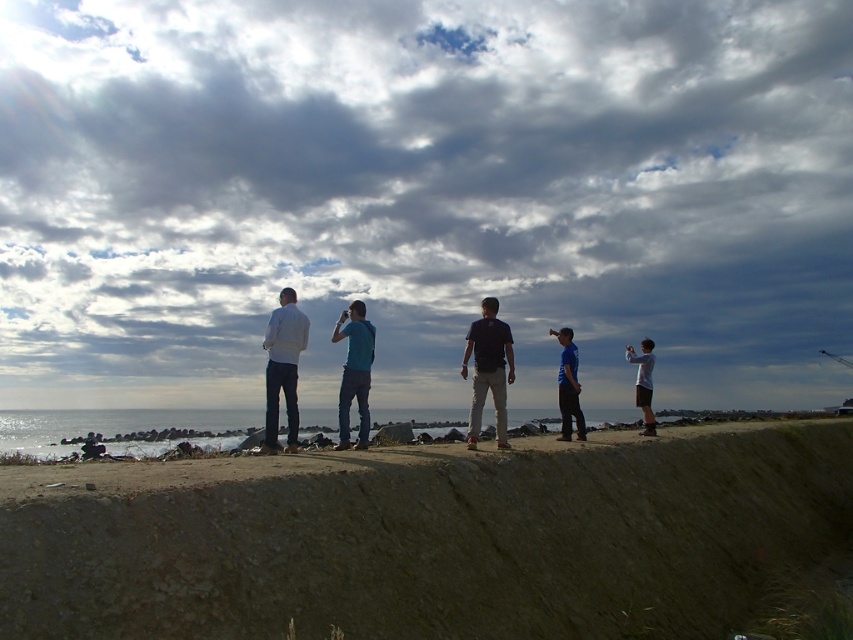
You are a photographer standing at the edge of the embankment. You want to take a photo of the white matte jacket at center. Where should you position yourself to capture it in the frame?

The white matte jacket at center is located at point (282,369), so you should position yourself directly facing the center of the group to capture it in the frame.

You are a photographer trying to capture a group photo of the white matte jacket at center and the white matte shirt at right. Since you want to ensure both are clearly visible, you need to adjust your camera settings based on their sizes. Which object should you focus on first to ensure proper focus, considering their sizes?

The white matte jacket at center is smaller than the white matte shirt at right, so you should focus on the white matte jacket at center first to ensure it is in focus, as smaller objects may require closer attention to maintain clarity.